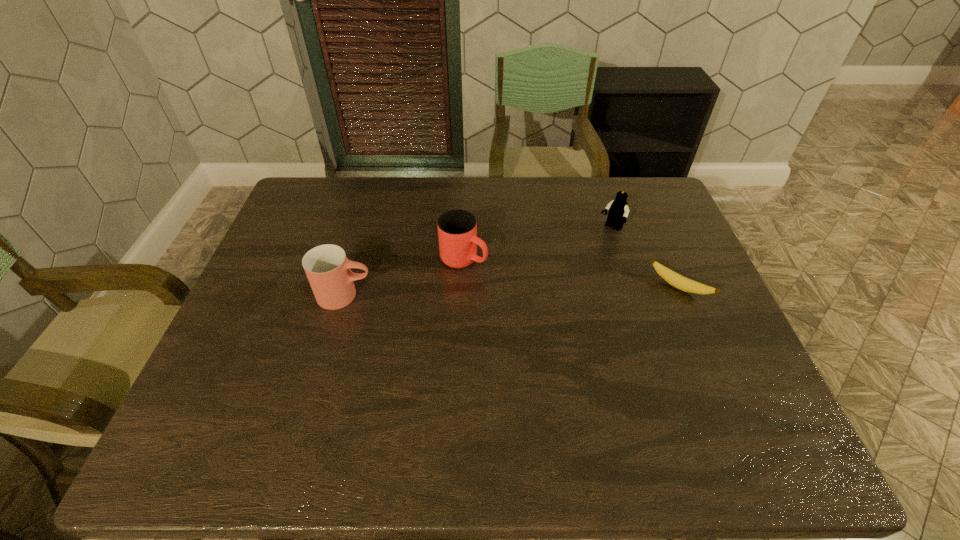
This screenshot has width=960, height=540. In order to click on vacant space on the desktop that is between the nearer cup and the rightmost object and is positioned on the handle side of the farther cup in this screenshot , I will do `click(528, 291)`.

Locate an element on the screen. The height and width of the screenshot is (540, 960). vacant space on the desktop that is between the left cup and the banana and is positioned on the front-facing side of the Lego is located at coordinates (553, 290).